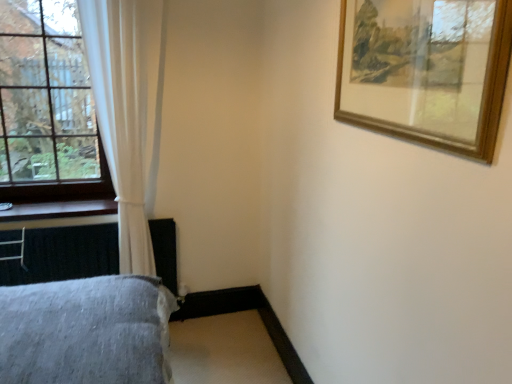
Question: From a real-world perspective, is clear glass window at left over wooden picture frame at upper right?

Choices:
 (A) yes
 (B) no

Answer: (B)

Question: Does clear glass window at left turn towards wooden picture frame at upper right?

Choices:
 (A) no
 (B) yes

Answer: (A)

Question: Is wooden picture frame at upper right at the back of clear glass window at left?

Choices:
 (A) yes
 (B) no

Answer: (B)

Question: Is clear glass window at left positioned behind wooden picture frame at upper right?

Choices:
 (A) yes
 (B) no

Answer: (A)

Question: Can you confirm if clear glass window at left is positioned to the right of wooden picture frame at upper right?

Choices:
 (A) yes
 (B) no

Answer: (B)

Question: From the image's perspective, is clear glass window at left on top of wooden picture frame at upper right?

Choices:
 (A) no
 (B) yes

Answer: (B)

Question: Is gray fabric bed at lower left facing away from wooden at left?

Choices:
 (A) no
 (B) yes

Answer: (B)

Question: Considering the relative sizes of gray fabric bed at lower left and wooden at left in the image provided, is gray fabric bed at lower left thinner than wooden at left?

Choices:
 (A) no
 (B) yes

Answer: (B)

Question: Is gray fabric bed at lower left to the left of wooden at left from the viewer's perspective?

Choices:
 (A) yes
 (B) no

Answer: (B)

Question: Is gray fabric bed at lower left outside wooden at left?

Choices:
 (A) no
 (B) yes

Answer: (B)

Question: From the image's perspective, is gray fabric bed at lower left above wooden at left?

Choices:
 (A) no
 (B) yes

Answer: (A)

Question: Considering the relative sizes of gray fabric bed at lower left and wooden at left in the image provided, is gray fabric bed at lower left bigger than wooden at left?

Choices:
 (A) no
 (B) yes

Answer: (B)

Question: Does clear glass window at left appear on the left side of wooden at left?

Choices:
 (A) no
 (B) yes

Answer: (B)